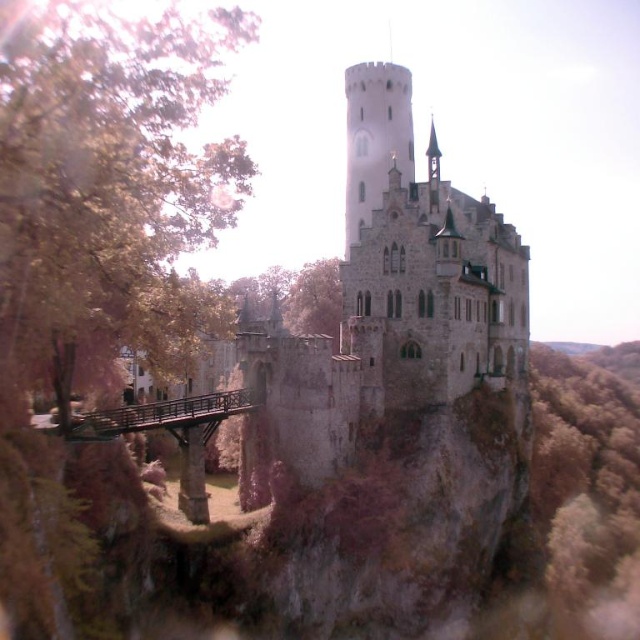
Question: Is stone medieval castle at center to the right of brown wooden bridge at lower center from the viewer's perspective?

Choices:
 (A) no
 (B) yes

Answer: (B)

Question: From the image, what is the correct spatial relationship of brown leafy tree at left in relation to stone medieval castle at center?

Choices:
 (A) left
 (B) right

Answer: (A)

Question: Which object appears farthest from the camera in this image?

Choices:
 (A) brown wooden bridge at lower center
 (B) stone medieval castle at center
 (C) brown wooden bridge at lower left
 (D) brown leafy tree at left

Answer: (B)

Question: Which object is positioned farthest from the brown leafy tree at left?

Choices:
 (A) stone medieval castle at center
 (B) brown wooden bridge at lower center
 (C) brown wooden bridge at lower left

Answer: (A)

Question: Which object is closer to the camera taking this photo?

Choices:
 (A) brown wooden bridge at lower left
 (B) brown leafy tree at left
 (C) brown wooden bridge at lower center
 (D) stone medieval castle at center

Answer: (B)

Question: Does brown leafy tree at left appear over stone medieval castle at center?

Choices:
 (A) no
 (B) yes

Answer: (B)